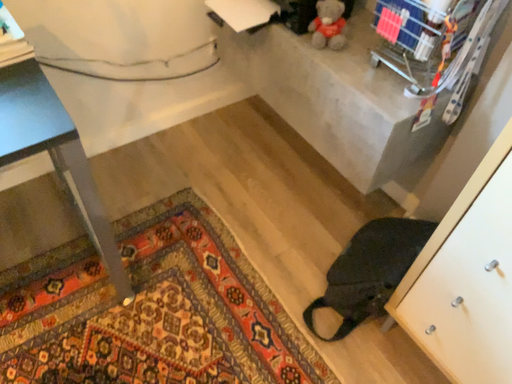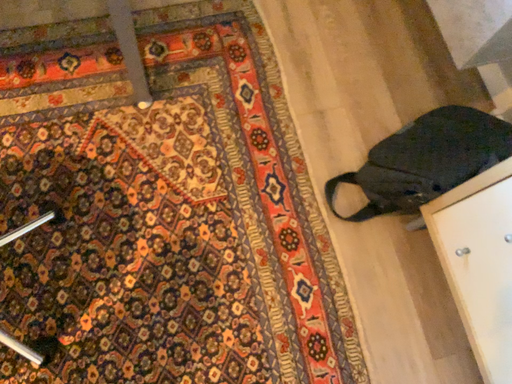
Question: Which way did the camera rotate in the video?

Choices:
 (A) rotated right
 (B) rotated left

Answer: (B)